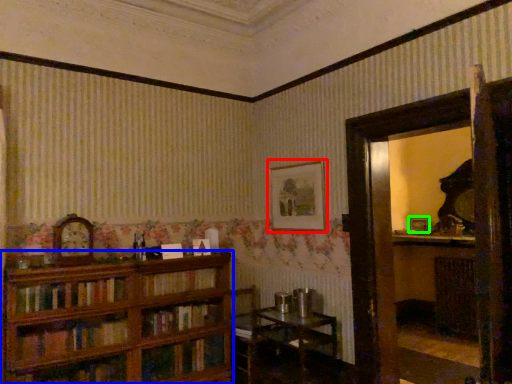
Question: Considering the real-world distances, which object is farthest from picture frame (highlighted by a red box)? bookcase (highlighted by a blue box) or picture frame (highlighted by a green box)?

Choices:
 (A) bookcase
 (B) picture frame

Answer: (B)